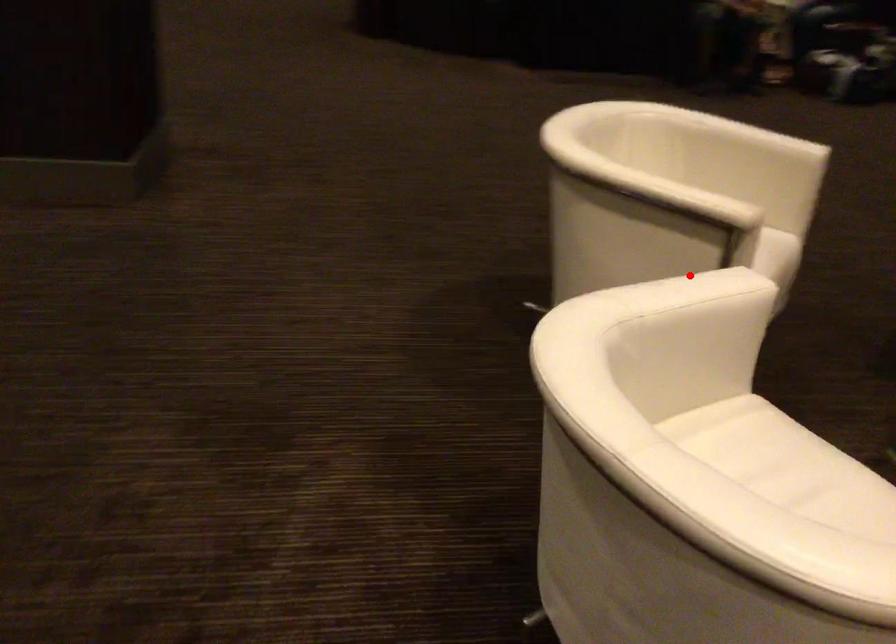
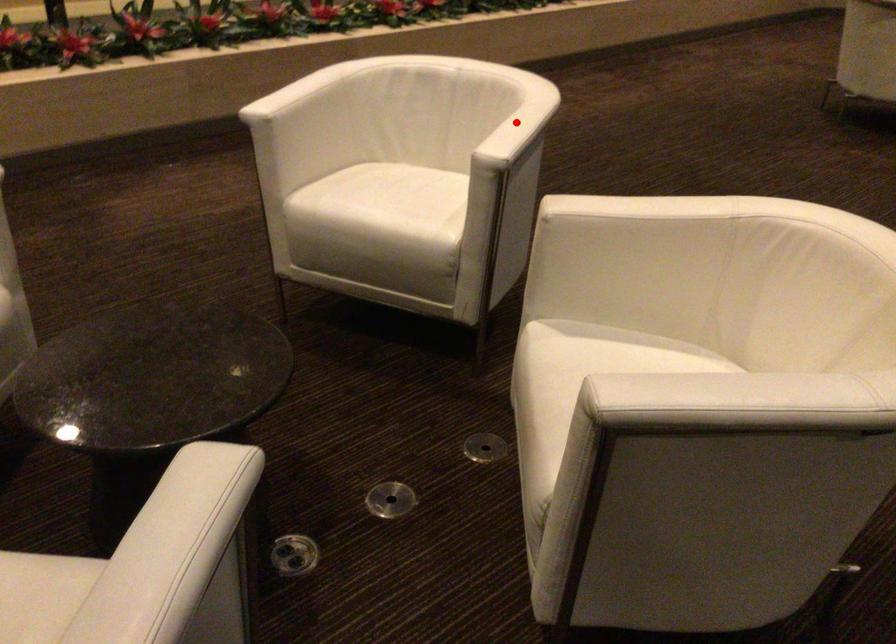
I am providing you with two images of the same scene from different viewpoints. A red point is marked on the first image and another point is marked on the second image. Does the point marked in image1 correspond to the same location as the one in image2?

Yes